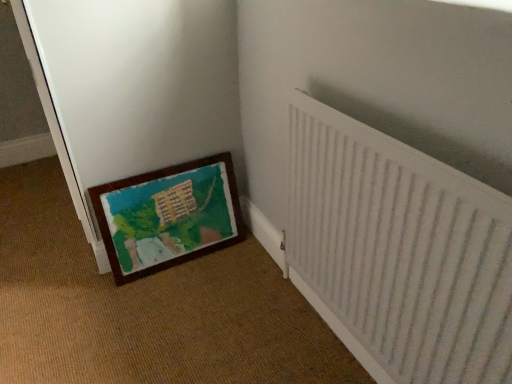
Question: Considering the relative sizes of wooden picture frame at lower left and white textured radiator at right in the image provided, is wooden picture frame at lower left wider than white textured radiator at right?

Choices:
 (A) no
 (B) yes

Answer: (B)

Question: Are wooden picture frame at lower left and white textured radiator at right making contact?

Choices:
 (A) no
 (B) yes

Answer: (A)

Question: Does wooden picture frame at lower left have a larger size compared to white textured radiator at right?

Choices:
 (A) no
 (B) yes

Answer: (A)

Question: From a real-world perspective, is wooden picture frame at lower left on top of white textured radiator at right?

Choices:
 (A) yes
 (B) no

Answer: (B)

Question: Is white textured radiator at right surrounded by wooden picture frame at lower left?

Choices:
 (A) yes
 (B) no

Answer: (B)

Question: From the image's perspective, is white textured radiator at right positioned above or below wooden picture frame at lower left?

Choices:
 (A) below
 (B) above

Answer: (A)

Question: Would you say white textured radiator at right is to the left or to the right of wooden picture frame at lower left in the picture?

Choices:
 (A) right
 (B) left

Answer: (A)

Question: Looking at the image, does white textured radiator at right seem bigger or smaller compared to wooden picture frame at lower left?

Choices:
 (A) small
 (B) big

Answer: (B)

Question: Is white textured radiator at right spatially inside wooden picture frame at lower left, or outside of it?

Choices:
 (A) inside
 (B) outside

Answer: (B)

Question: Is wooden picture frame at lower left taller or shorter than white textured radiator at right?

Choices:
 (A) tall
 (B) short

Answer: (B)

Question: Is point (219, 178) closer or farther from the camera than point (303, 97)?

Choices:
 (A) farther
 (B) closer

Answer: (A)

Question: Looking at their shapes, would you say wooden picture frame at lower left is wider or thinner than white textured radiator at right?

Choices:
 (A) wide
 (B) thin

Answer: (A)

Question: Based on their sizes in the image, would you say wooden picture frame at lower left is bigger or smaller than white textured radiator at right?

Choices:
 (A) small
 (B) big

Answer: (A)

Question: Considering the positions of point (102, 59) and point (226, 240), is point (102, 59) closer or farther from the camera than point (226, 240)?

Choices:
 (A) farther
 (B) closer

Answer: (B)

Question: Is wooden painted mat at lower left spatially inside wooden picture frame at lower left, or outside of it?

Choices:
 (A) outside
 (B) inside

Answer: (A)